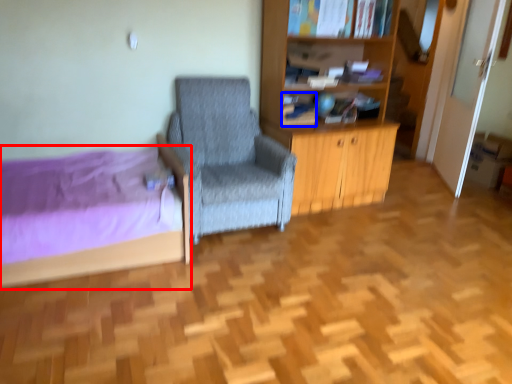
Question: Which point is further to the camera, bed (highlighted by a red box) or book (highlighted by a blue box)?

Choices:
 (A) bed
 (B) book

Answer: (B)